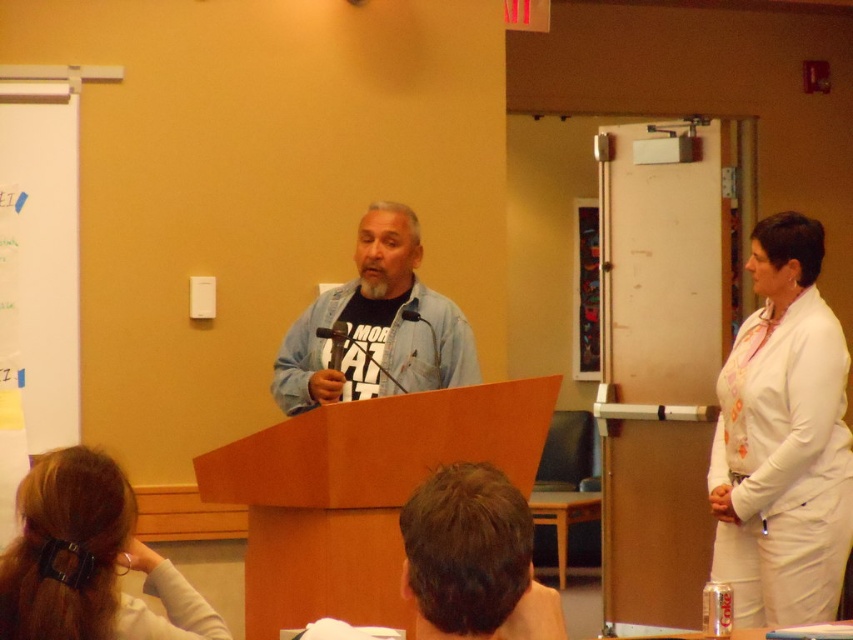
You are an attendee at the presentation and notice two people in the front row. One is wearing a white fabric blouse at right and the other a denim jacket at center. Which person is taller?

The white fabric blouse at right has a greater height compared to the denim jacket at center, so the person wearing the white fabric blouse at right is taller.

You are organizing a small event in the room and need to place a 3 feet wide table between the white fabric blouse at right and the blonde hair at lower left. Will there be enough space?

The white fabric blouse at right is 7.77 feet from blonde hair at lower left. Since the table is 3 feet wide, there is sufficient space between them to place the table as the distance is greater than the table width.

You are an observer in the room. You notice the white fabric blouse at right and the denim jacket at center. Which clothing item appears narrower?

A: The white fabric blouse at right has a lesser width compared to the denim jacket at center, so the white fabric blouse at right appears narrower.